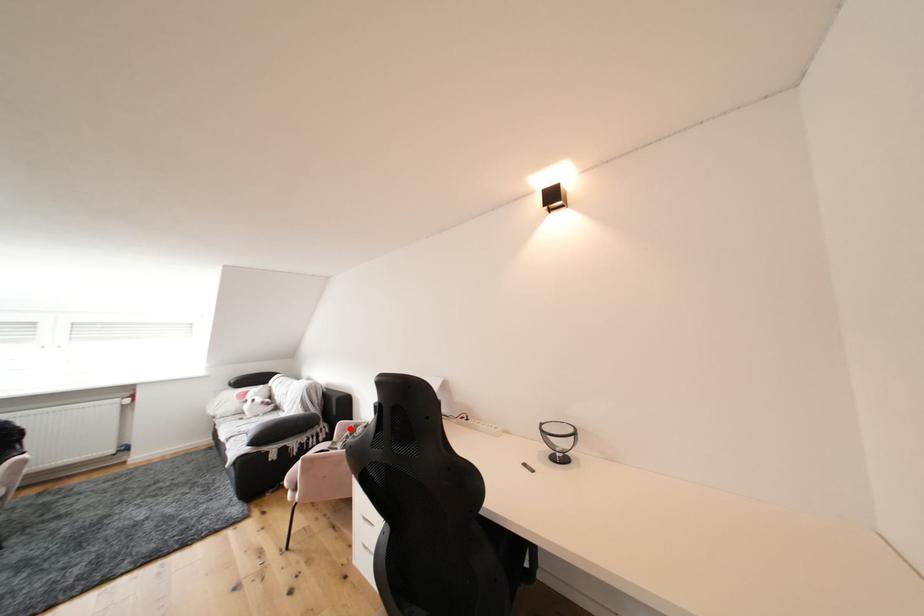
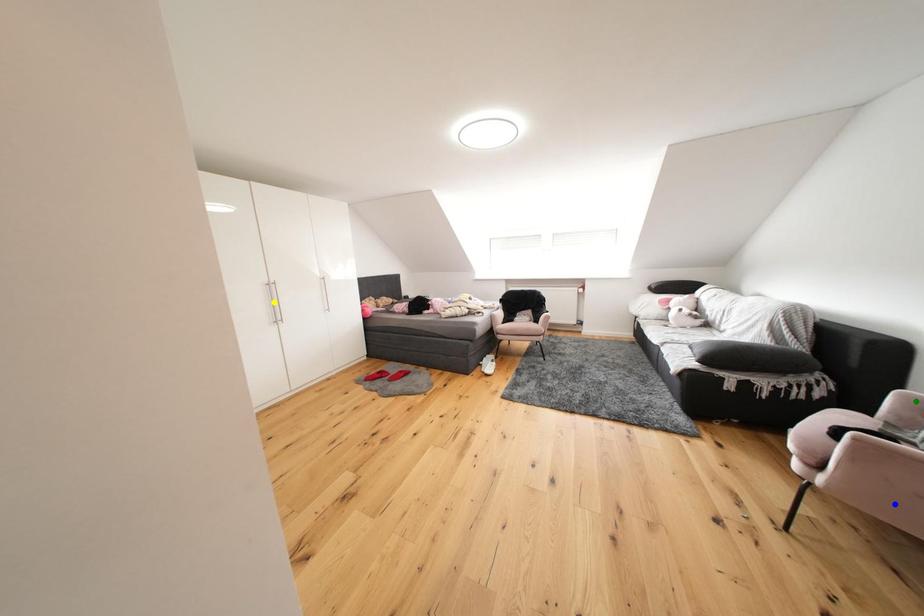
Question: I am providing you with two images of the same scene from different viewpoints. A red point is marked on the first image. You are given multiple points on the second image. Which mark in image 2 goes with the point in image 1?

Choices:
 (A) green point
 (B) yellow point
 (C) blue point

Answer: (A)